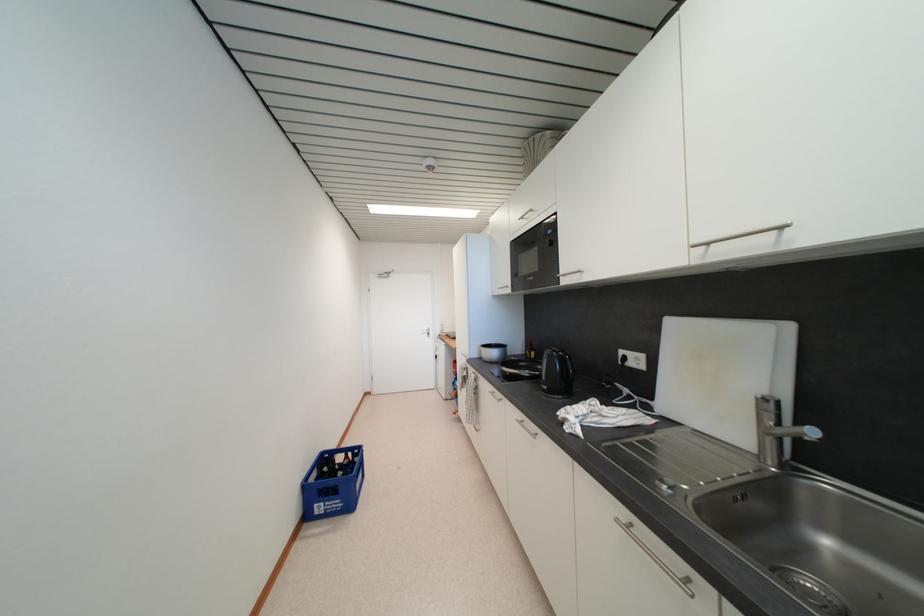
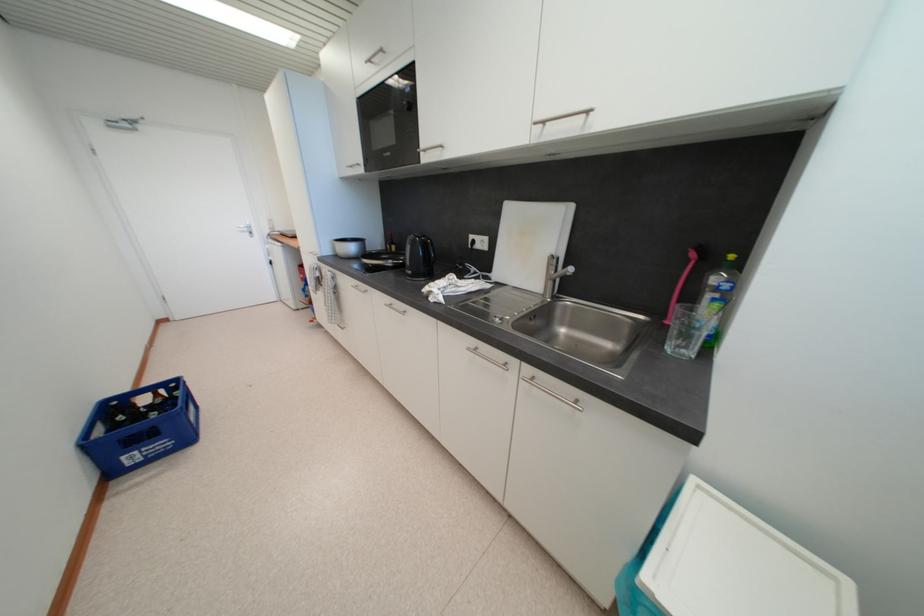
The point at (496, 391) is marked in the first image. Where is the corresponding point in the second image?

(359, 285)